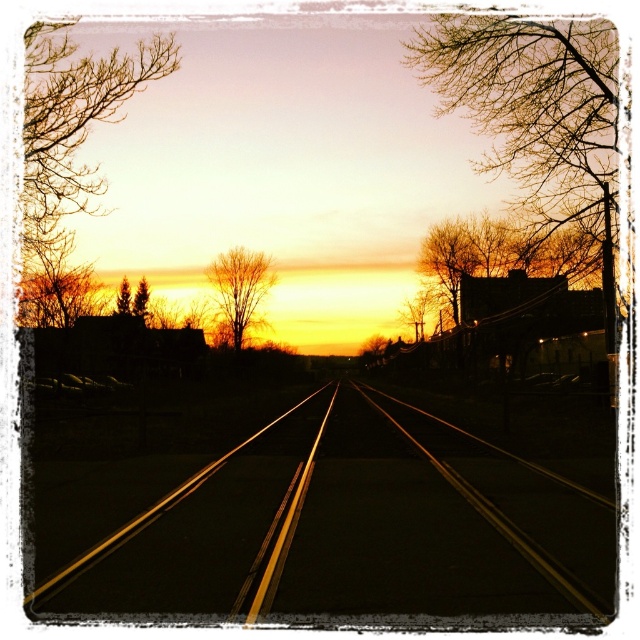
Between metal/yellowishobject at center and bare branches at center, which one is positioned higher?

bare branches at center is higher up.

Does metal/yellowishobject at center appear on the right side of bare branches at center?

Yes, metal/yellowishobject at center is to the right of bare branches at center.

Is point (547, 611) closer to camera compared to point (256, 275)?

Yes, it is.

You are a GUI agent. You are given a task and a screenshot of the screen. Output one action in this format:
    pyautogui.click(x=<x>, y=<y>)
    Task: Click on the metal/yellowishobject at center
    Image resolution: width=640 pixels, height=640 pixels.
    Given the screenshot: What is the action you would take?
    pyautogui.click(x=323, y=524)

Is bare branches at center wider than green matte tree at left?

Correct, the width of bare branches at center exceeds that of green matte tree at left.

Does point (252, 300) come behind point (120, 314)?

That is True.

This screenshot has height=640, width=640. I want to click on bare branches at center, so click(241, 289).

Does point (486, 132) come behind point (120, 304)?

Yes, point (486, 132) is behind point (120, 304).

Is bare branches at upper right below green matte tree at left?

No.

At what (x,y) coordinates should I click in order to perform the action: click on bare branches at upper right. Please return your answer as a coordinate pair (x, y). Looking at the image, I should click on (532, 104).

You are a GUI agent. You are given a task and a screenshot of the screen. Output one action in this format:
    pyautogui.click(x=<x>, y=<y>)
    Task: Click on the bare branches at upper right
    This screenshot has width=640, height=640.
    Given the screenshot: What is the action you would take?
    pyautogui.click(x=532, y=104)